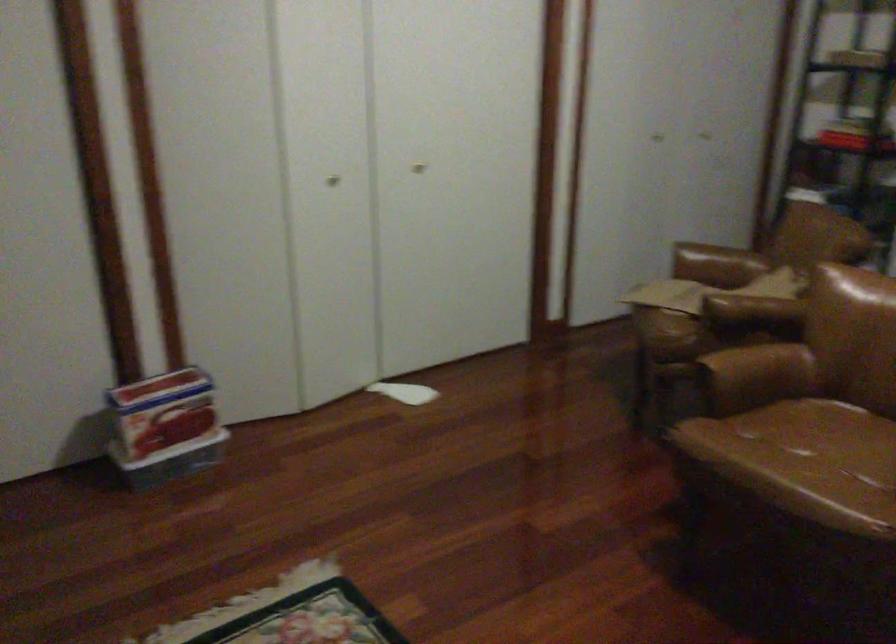
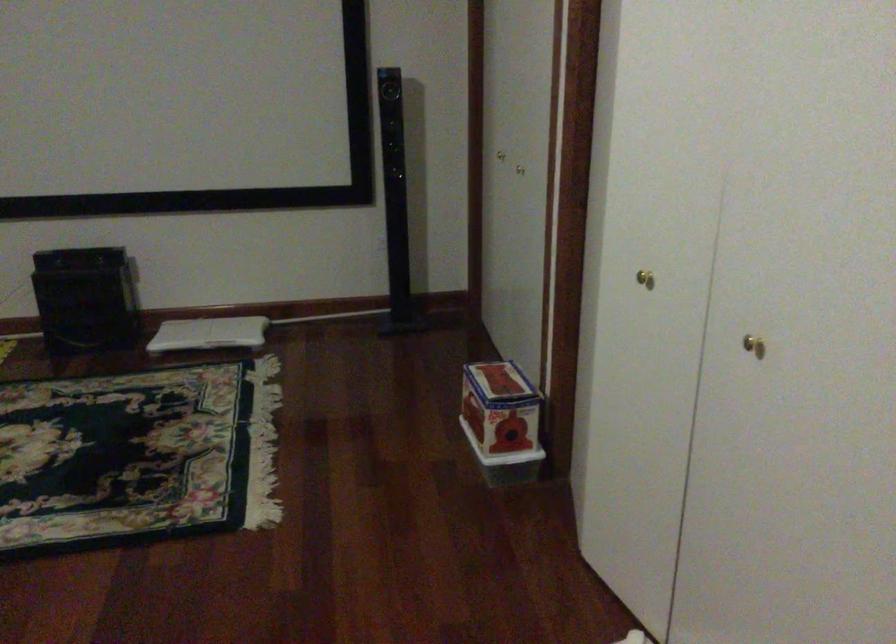
The point at (330, 172) is marked in the first image. Where is the corresponding point in the second image?

(644, 279)